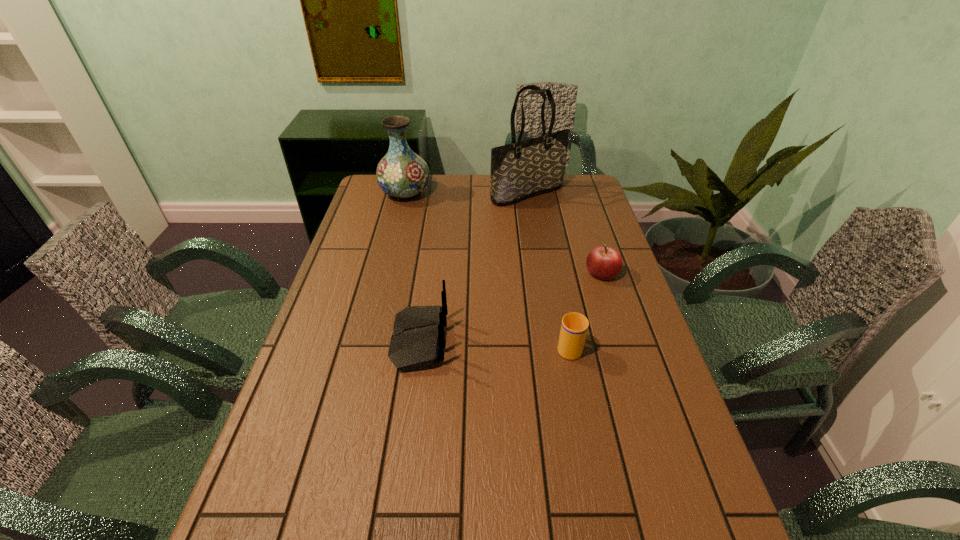
Identify the location of vacant space at the left edge. (338, 294).

Identify the location of vacant space at the right edge of the desktop. (626, 318).

At what (x,y) coordinates should I click in order to perform the action: click on vacant space at the far right corner of the desktop. Please return your answer as a coordinate pair (x, y). Image resolution: width=960 pixels, height=540 pixels. Looking at the image, I should click on (587, 199).

The image size is (960, 540). Find the location of `vacant area that lies between the apple and the second tallest object`. vacant area that lies between the apple and the second tallest object is located at coordinates (503, 233).

What are the coordinates of `vacant region between the tallest object and the third nearest object` in the screenshot? It's located at (564, 233).

The width and height of the screenshot is (960, 540). Identify the location of free space that is in between the apple and the third shortest object. (511, 307).

Where is `free area in between the third shortest object and the cup`? The image size is (960, 540). free area in between the third shortest object and the cup is located at coordinates (494, 344).

The width and height of the screenshot is (960, 540). I want to click on vacant area that lies between the apple and the vase, so click(503, 233).

The width and height of the screenshot is (960, 540). In order to click on free area in between the tallest object and the apple in this screenshot , I will do `click(564, 233)`.

Identify the location of free spot between the apple and the vase. The height and width of the screenshot is (540, 960). (503, 233).